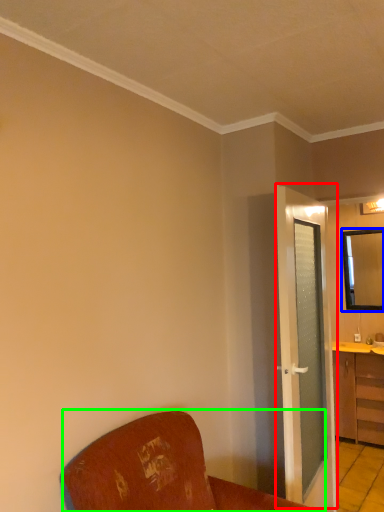
Question: Which object is the closest to the door (highlighted by a red box)? Choose among these: mirror (highlighted by a blue box) or furniture (highlighted by a green box).

Choices:
 (A) mirror
 (B) furniture

Answer: (B)